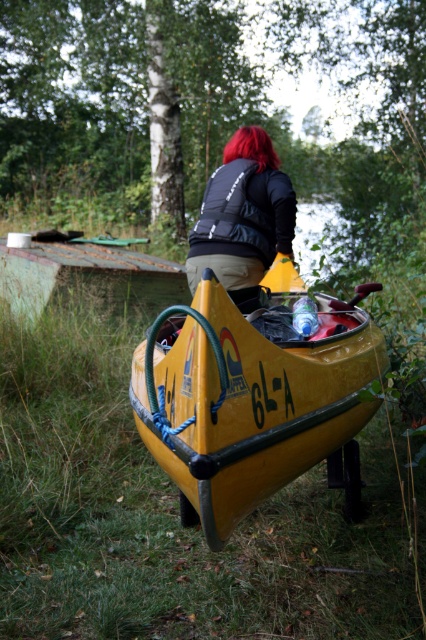
Question: Which object is farther from the camera taking this photo?

Choices:
 (A) red hair at upper center
 (B) yellow matte boat at center

Answer: (A)

Question: Can you confirm if yellow matte boat at center is positioned above red hair at upper center?

Choices:
 (A) no
 (B) yes

Answer: (A)

Question: Among these points, which one is nearest to the camera?

Choices:
 (A) (250, 148)
 (B) (235, 144)

Answer: (A)

Question: Which point appears closest to the camera in this image?

Choices:
 (A) (282, 220)
 (B) (247, 154)
 (C) (147, 442)

Answer: (C)

Question: Considering the relative positions of black matte vest at center and red hair at upper center in the image provided, where is black matte vest at center located with respect to red hair at upper center?

Choices:
 (A) right
 (B) left

Answer: (A)

Question: Is yellow matte boat at center wider than red hair at upper center?

Choices:
 (A) yes
 (B) no

Answer: (A)